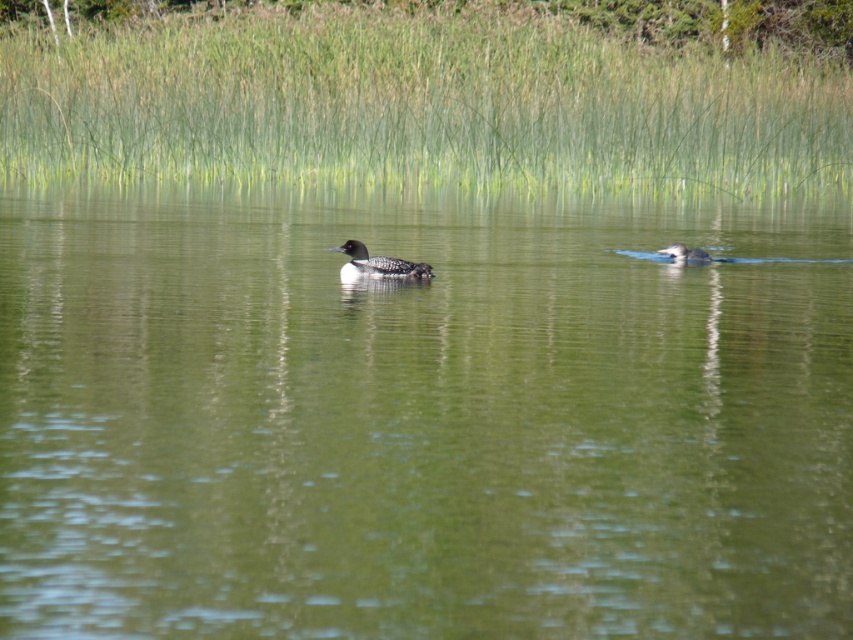
Question: Estimate the real-world distances between objects in this image. Which object is farther from the green grass at upper center?

Choices:
 (A) green smooth water at center
 (B) dark gray duck at center
 (C) dark gray matte duck at center

Answer: (C)

Question: Can you confirm if green grass at upper center is thinner than dark gray matte duck at center?

Choices:
 (A) yes
 (B) no

Answer: (B)

Question: Can you confirm if green smooth water at center is positioned above green grass at upper center?

Choices:
 (A) yes
 (B) no

Answer: (B)

Question: Does green grass at upper center have a greater width compared to dark gray matte duck at center?

Choices:
 (A) yes
 (B) no

Answer: (A)

Question: Which object is the farthest from the dark gray matte duck at center?

Choices:
 (A) dark gray duck at center
 (B) green smooth water at center

Answer: (A)

Question: Which object is the closest to the dark gray matte duck at center?

Choices:
 (A) green smooth water at center
 (B) dark gray duck at center
 (C) green grass at upper center

Answer: (A)